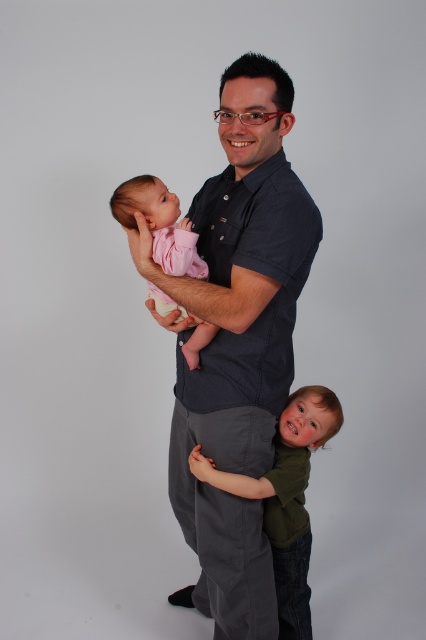
You are a photographer setting up for a family portrait. You need to position a light source to the right of the dark blue shirt at center and the green matte shirt at lower right. Based on their positions, which shirt should the light source be placed to the right of?

The light source should be placed to the right of the green matte shirt at lower right because the dark blue shirt at center is located to the left of the green matte shirt at lower right.

You are a photographer setting up for a family portrait. You need to ensure that the dark blue shirt at center and the pink soft fabric baby at left are both clearly visible in the photo. Based on their sizes, which object should you focus on first to ensure proper exposure?

The dark blue shirt at center is bigger than the pink soft fabric baby at left, so you should focus on the dark blue shirt at center first to ensure proper exposure since it covers more area and requires accurate lighting.

You are a photographer setting up a photo shoot. You need to place a small microphone near the dark blue shirt at center and the green matte shirt at lower right so both can be heard clearly. Where should you position the microphone relative to these shirts?

The microphone should be placed between the dark blue shirt at center and the green matte shirt at lower right. Since the dark blue shirt at center is larger in size than the green matte shirt at lower right, positioning it centrally between them would ensure both are within the microphone pickup range.